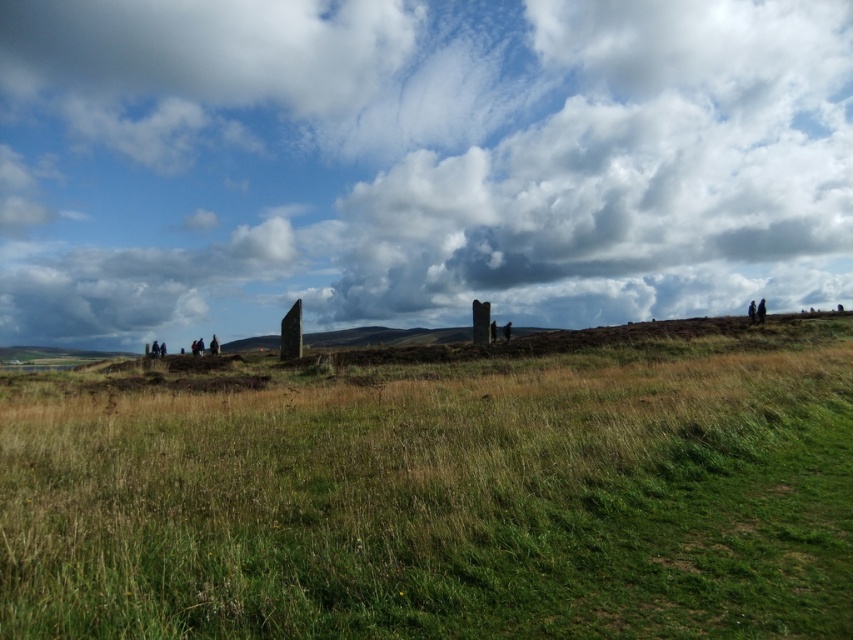
You are a photographer planning to capture the cloudy sky at upper center and the green grassy field at center in a single shot. Based on their sizes in the image, which one will occupy more of the frame?

The cloudy sky at upper center is larger in size than the green grassy field at center, so it will occupy more of the frame.

You are a photographer planning to capture the cloudy sky at upper center and the green grassy field at center in a single shot. Based on their positions, which object will appear more to the left in your photo?

The cloudy sky at upper center is positioned on the left side of green grassy field at center, so it will appear more to the left in the photo.

You are standing in the grassy field and want to look up at the cloudy sky at upper center. In which direction should you look relative to your position?

You should look upward toward the upper center direction to view the cloudy sky at upper center.